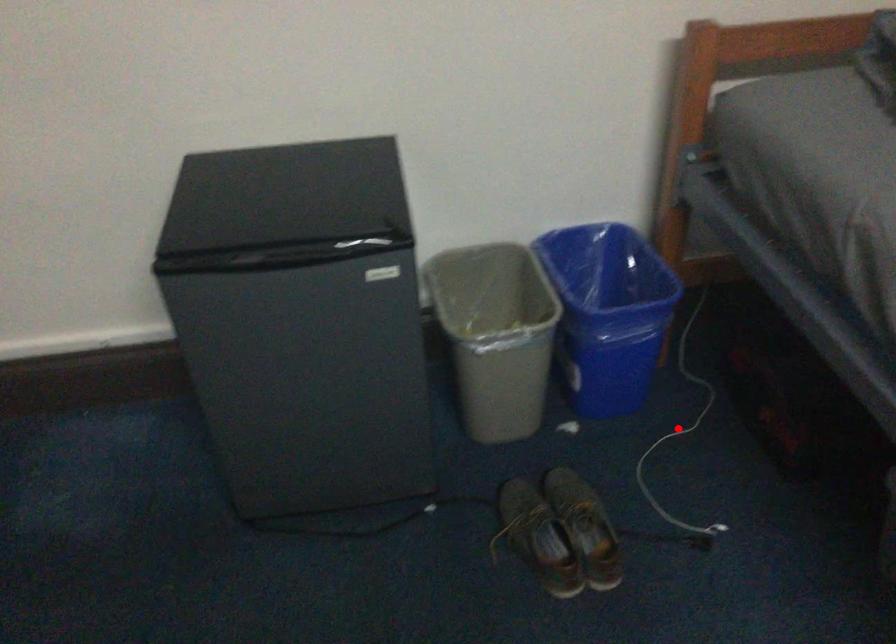
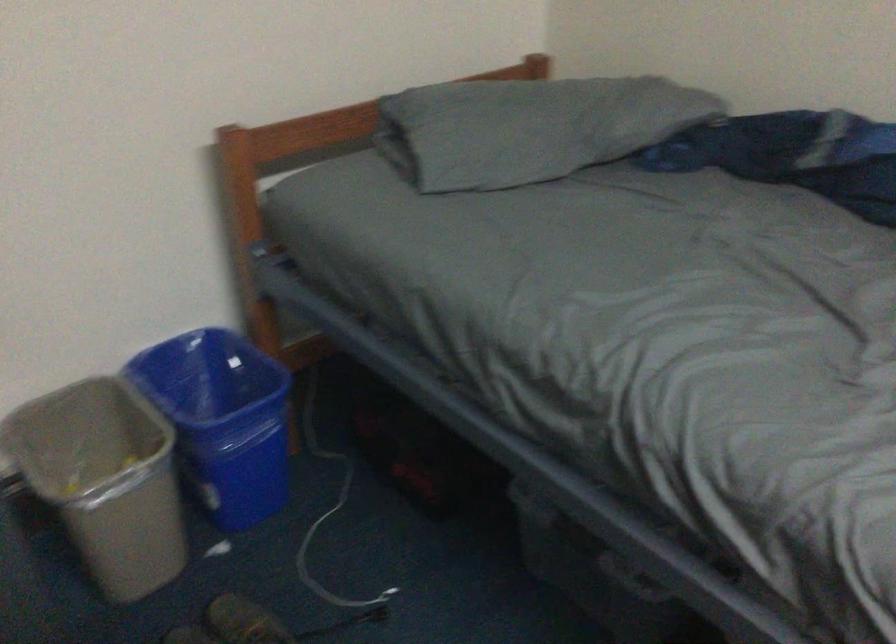
Where in the second image is the point corresponding to the highlighted location from the first image?

(328, 509)